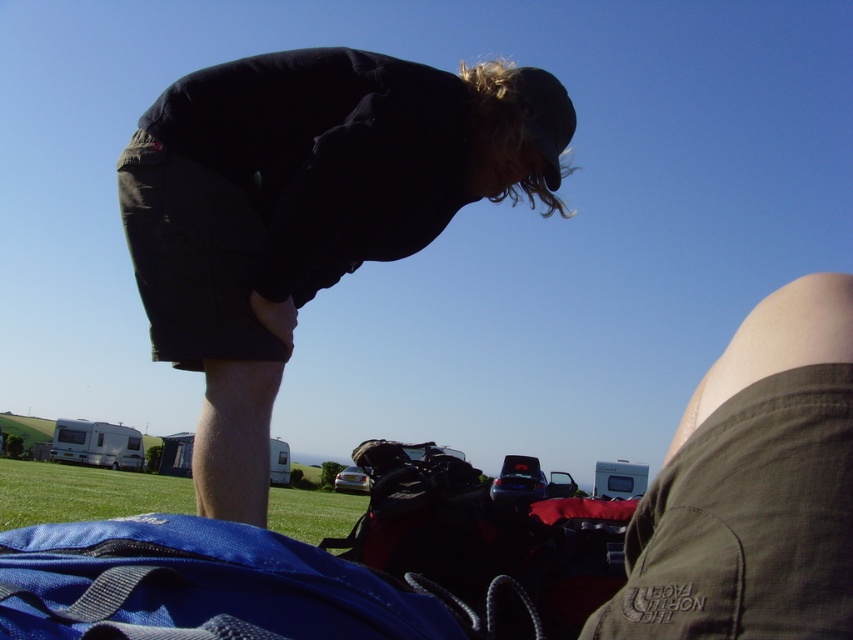
Question: Is blue fabric sleeping bag at lower left bigger than green grass at lower left?

Choices:
 (A) yes
 (B) no

Answer: (B)

Question: Is black fabric man at center above blue fabric sleeping bag at lower left?

Choices:
 (A) no
 (B) yes

Answer: (B)

Question: Which of the following is the closest to the observer?

Choices:
 (A) blue fabric sleeping bag at lower left
 (B) black fabric man at center
 (C) green grass at lower left

Answer: (A)

Question: Which is farther from the green grass at lower left?

Choices:
 (A) blue fabric sleeping bag at lower left
 (B) black fabric man at center

Answer: (B)

Question: Which point is farther from the camera taking this photo?

Choices:
 (A) (306, 499)
 (B) (355, 224)
 (C) (88, 609)

Answer: (A)

Question: Can you confirm if black fabric man at center is bigger than blue fabric sleeping bag at lower left?

Choices:
 (A) no
 (B) yes

Answer: (B)